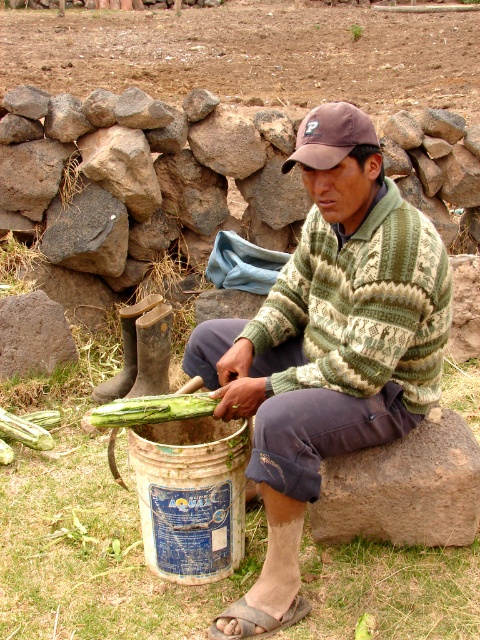
Measure the distance from green rough corn at center to green rough squash at center.

green rough corn at center is 1.14 meters away from green rough squash at center.

The height and width of the screenshot is (640, 480). What are the coordinates of `green rough corn at center` in the screenshot? It's located at (153, 410).

Find the location of a particular element. This screenshot has width=480, height=640. green rough corn at center is located at coordinates (153, 410).

I want to click on green rough corn at center, so click(153, 410).

Does green knitted sweater at center appear over green rough squash at center?

Indeed, green knitted sweater at center is positioned over green rough squash at center.

Locate an element on the screen. This screenshot has height=640, width=480. green knitted sweater at center is located at coordinates (327, 346).

Can you confirm if green knitted sweater at center is positioned above green rough corn at center?

Indeed, green knitted sweater at center is positioned over green rough corn at center.

Is point (440, 332) farther from viewer compared to point (135, 404)?

Yes.

Which is behind, point (339, 387) or point (182, 403)?

The point (182, 403) is more distant.

Where is `green knitted sweater at center`? The height and width of the screenshot is (640, 480). green knitted sweater at center is located at coordinates click(x=327, y=346).